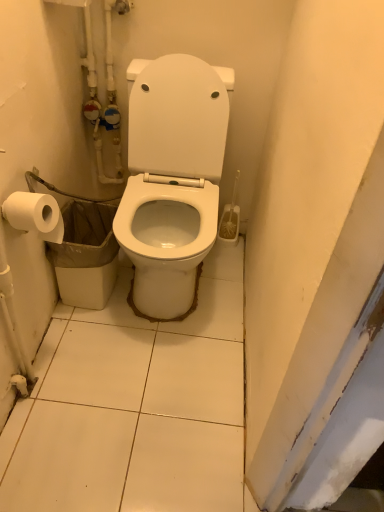
In order to face white matte toilet paper at left, should I rotate leftwards or rightwards?

Rotate left and turn 20.318 degrees.

This screenshot has width=384, height=512. What are the coordinates of `white plastic trash can at lower left` in the screenshot? It's located at (86, 255).

What are the coordinates of `white glossy toilet at center` in the screenshot? It's located at (172, 180).

Is point (185, 287) positioned behind point (91, 261)?

Yes, it is behind point (91, 261).

Considering the sizes of objects white glossy toilet at center and white plastic trash can at lower left in the image provided, who is taller, white glossy toilet at center or white plastic trash can at lower left?

With more height is white glossy toilet at center.

From a real-world perspective, is white glossy toilet at center physically above white plastic trash can at lower left?

Yes.

Which object is positioned more to the left, white glossy toilet at center or white plastic trash can at lower left?

white plastic trash can at lower left.

Does white glossy toilet at center appear on the left side of white matte toilet paper at left?

In fact, white glossy toilet at center is to the right of white matte toilet paper at left.

Can you tell me how much white glossy toilet at center and white matte toilet paper at left differ in facing direction?

The facing directions of white glossy toilet at center and white matte toilet paper at left are 90.8 degrees apart.

Can you confirm if white glossy toilet at center is wider than white matte toilet paper at left?

Yes, white glossy toilet at center is wider than white matte toilet paper at left.

Considering the relative sizes of white glossy toilet at center and white matte toilet paper at left in the image provided, is white glossy toilet at center shorter than white matte toilet paper at left?

Incorrect, the height of white glossy toilet at center does not fall short of that of white matte toilet paper at left.

From the image's perspective, is white matte toilet paper at left located above or below white plastic trash can at lower left?

From the image's perspective, white matte toilet paper at left appears above white plastic trash can at lower left.

Which is in front, white matte toilet paper at left or white plastic trash can at lower left?

white matte toilet paper at left is closer to the camera.

The image size is (384, 512). In order to click on garbage behind the white matte toilet paper at left in this screenshot , I will do `click(86, 255)`.

Is white matte toilet paper at left completely or partially outside of white plastic trash can at lower left?

white matte toilet paper at left is positioned outside white plastic trash can at lower left.

Can you confirm if white plastic trash can at lower left is positioned to the right of white matte toilet paper at left?

Yes.

Is the position of white plastic trash can at lower left more distant than that of white matte toilet paper at left?

Yes, white plastic trash can at lower left is behind white matte toilet paper at left.

Is white plastic trash can at lower left facing away from white matte toilet paper at left?

No, white plastic trash can at lower left is not facing away from white matte toilet paper at left.

Is white matte toilet paper at left taller than white glossy toilet at center?

No.

How much distance is there between white matte toilet paper at left and white glossy toilet at center?

white matte toilet paper at left is 46.04 centimeters from white glossy toilet at center.

Considering the positions of objects white matte toilet paper at left and white glossy toilet at center in the image provided, who is more to the right, white matte toilet paper at left or white glossy toilet at center?

From the viewer's perspective, white glossy toilet at center appears more on the right side.

From a real-world perspective, is white matte toilet paper at left over white glossy toilet at center?

Yes, from a real-world perspective, white matte toilet paper at left is above white glossy toilet at center.

In the scene shown: Which of these two, white plastic trash can at lower left or white glossy toilet at center, is thinner?

white plastic trash can at lower left.

From a real-world perspective, is white plastic trash can at lower left positioned above or below white glossy toilet at center?

Clearly, from a real-world perspective, white plastic trash can at lower left is below white glossy toilet at center.

Is white plastic trash can at lower left looking in the opposite direction of white glossy toilet at center?

That's not correct — white plastic trash can at lower left is not looking away from white glossy toilet at center.

Identify the location of garbage below the white glossy toilet at center (from the image's perspective). (86, 255).

This screenshot has height=512, width=384. In order to click on toilet paper behind the white glossy toilet at center in this screenshot , I will do `click(35, 215)`.

When comparing their distances from white glossy toilet at center, does white plastic trash can at lower left or white matte toilet paper at left seem closer?

Among the two, white plastic trash can at lower left is located nearer to white glossy toilet at center.

Considering their positions, is white matte toilet paper at left positioned further to white plastic trash can at lower left than white glossy toilet at center?

The object further to white plastic trash can at lower left is white matte toilet paper at left.

Considering their positions, is white matte toilet paper at left positioned closer to white glossy toilet at center than white plastic trash can at lower left?

Based on the image, white plastic trash can at lower left appears to be nearer to white glossy toilet at center.

Based on their spatial positions, is white glossy toilet at center or white plastic trash can at lower left further from white matte toilet paper at left?

white glossy toilet at center is further to white matte toilet paper at left.

Looking at the image, which one is located further to white plastic trash can at lower left, white glossy toilet at center or white matte toilet paper at left?

The object further to white plastic trash can at lower left is white matte toilet paper at left.

From the image, which object appears to be farther from white matte toilet paper at left, white plastic trash can at lower left or white glossy toilet at center?

Among the two, white glossy toilet at center is located further to white matte toilet paper at left.

The height and width of the screenshot is (512, 384). Identify the location of toilet paper located between white glossy toilet at center and white plastic trash can at lower left in the depth direction. (35, 215).